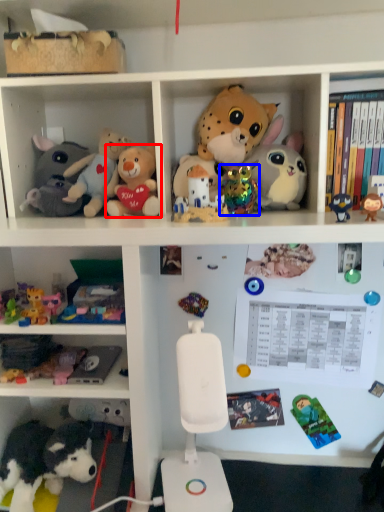
Question: Which object appears closest to the camera in this image, toy (highlighted by a red box) or toy (highlighted by a blue box)?

Choices:
 (A) toy
 (B) toy

Answer: (A)